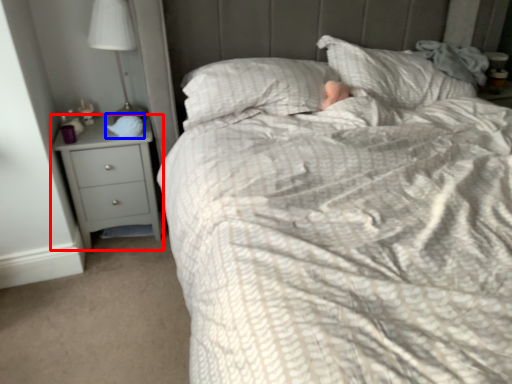
Question: Among these objects, which one is farthest to the camera, chest of drawers (highlighted by a red box) or sleeping bag (highlighted by a blue box)?

Choices:
 (A) chest of drawers
 (B) sleeping bag

Answer: (B)